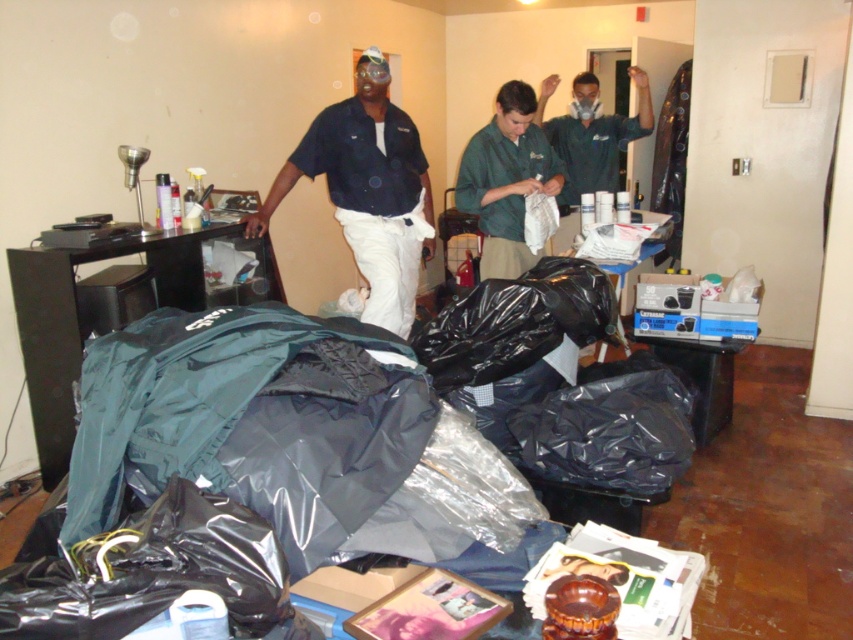
You are organizing items in the room and need to place both the black plastic bag at center and the green uniform at center into a storage container. The container can only accommodate items up to the size of the larger object. Which object determines the minimum required container size?

The black plastic bag at center determines the minimum required container size because its width is larger than the green uniform at center.

You are a person standing at the entrance of the room. You need to reach the speaker on the left side. Which item, the matte black shirt at center or the green uniform at center, is blocking your path more directly?

The green uniform at center is behind matte black shirt at center, so the matte black shirt at center is blocking your path more directly.

You are organizing items in the room and need to place a new item between the black plastic bag at center and the green uniform at center. Where should you place it?

The black plastic bag at center is on the left side of the green uniform at center, so you should place the new item between them by positioning it to the right of the black plastic bag at center and to the left of the green uniform at center.